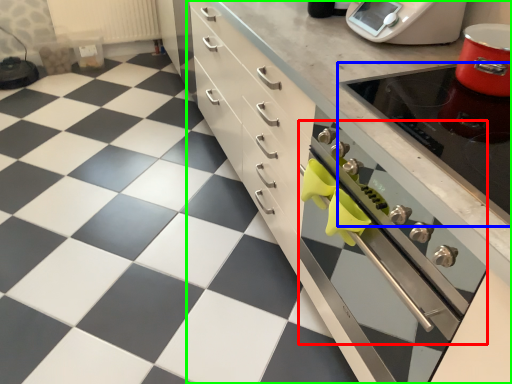
Question: Estimate the real-world distances between objects in this image. Which object is closer to oven (highlighted by a red box), appliance (highlighted by a blue box) or cabinetry (highlighted by a green box)?

Choices:
 (A) appliance
 (B) cabinetry

Answer: (B)